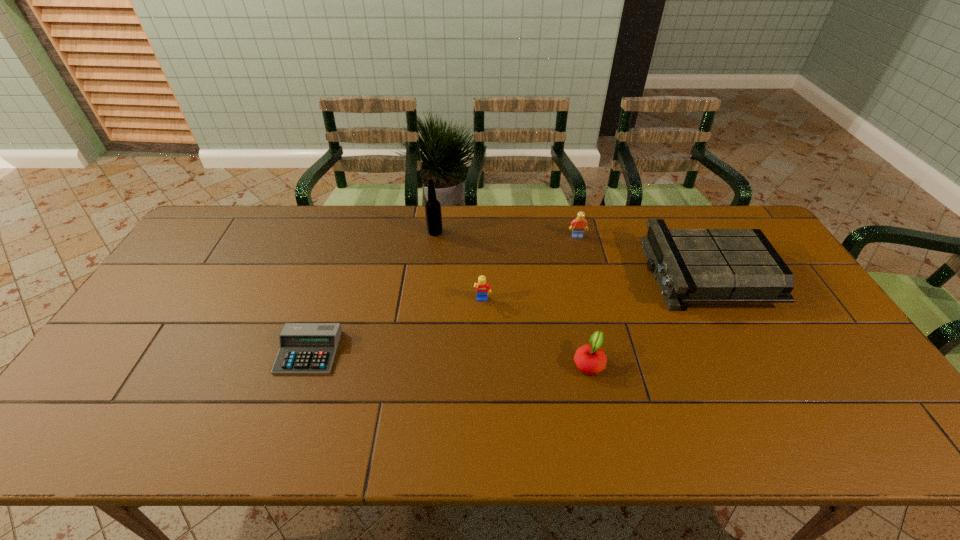
At what (x,y) coordinates should I click in order to perform the action: click on vacant space that's between the leftmost object and the right Lego. Please return your answer as a coordinate pair (x, y). Looking at the image, I should click on (443, 294).

The width and height of the screenshot is (960, 540). Find the location of `free space between the radio receiver and the fourth object from right to left`. free space between the radio receiver and the fourth object from right to left is located at coordinates (593, 287).

Locate an element on the screen. vacant space that is in between the nearer Lego and the second object from left to right is located at coordinates coord(459,267).

I want to click on vacant area that lies between the radio receiver and the shortest object, so click(x=507, y=313).

Where is `free space between the left Lego and the apple`? This screenshot has height=540, width=960. free space between the left Lego and the apple is located at coordinates (536, 332).

I want to click on vacant point located between the fourth object from right to left and the radio receiver, so click(593, 287).

Identify the location of unoccupied area between the tallest object and the fifth tallest object. (512, 298).

Locate an element on the screen. vacant area between the farther Lego and the second shortest object is located at coordinates (583, 299).

What are the coordinates of `object that is the fifth closest to the tallest object` in the screenshot? It's located at (690, 265).

The width and height of the screenshot is (960, 540). What are the coordinates of `the fifth closest object to the nearer Lego` in the screenshot? It's located at (690, 265).